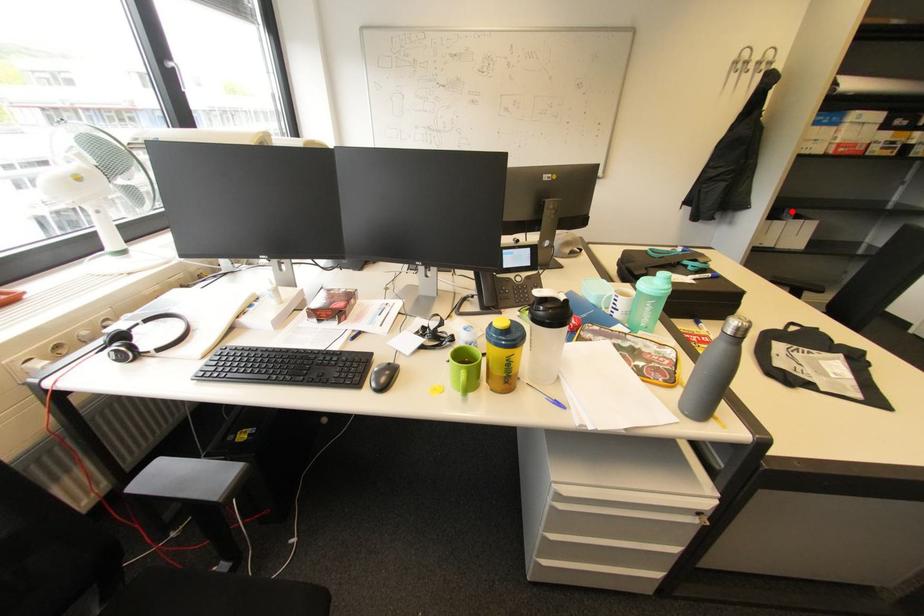
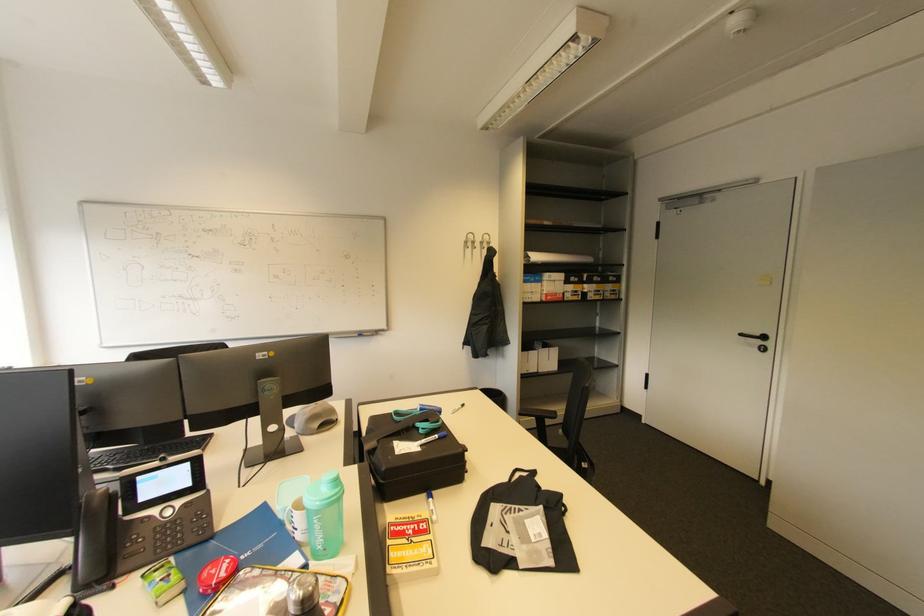
Question: I am providing you with two images of the same scene from different viewpoints. Given a red point in image1, look at the same physical point in image2. Is it:

Choices:
 (A) Closer to the viewpoint
 (B) Farther from the viewpoint

Answer: (B)